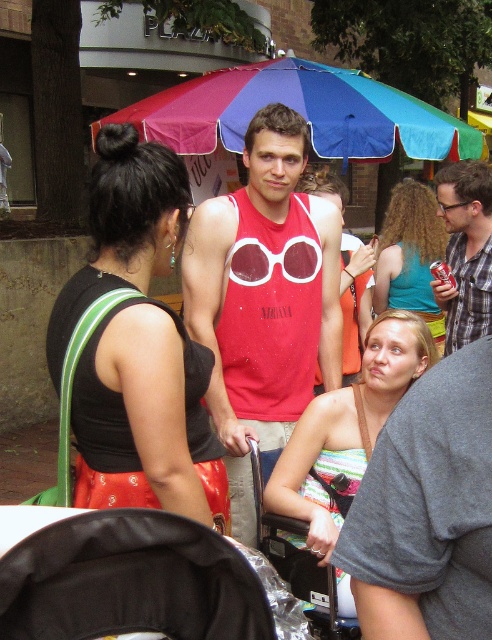
Question: Which object appears farthest from the camera in this image?

Choices:
 (A) matte plastic goggles at center
 (B) striped fabric dress at center
 (C) curly hair at center

Answer: (C)

Question: Can you confirm if curly hair at center is positioned above transparent plastic goggles at center?

Choices:
 (A) yes
 (B) no

Answer: (A)

Question: Based on their relative distances, which object is farther from the transparent plastic goggles at center?

Choices:
 (A) plaid shirt at center
 (B) matte plastic goggles at center
 (C) black fabric baby carriage at lower left
 (D) matte red tank top at center

Answer: (C)

Question: Can you confirm if black fabric baby carriage at lower left is wider than curly hair at center?

Choices:
 (A) yes
 (B) no

Answer: (B)

Question: Estimate the real-world distances between objects in this image. Which object is closer to the transparent plastic goggles at center?

Choices:
 (A) matte plastic goggles at center
 (B) matte red tank top at center
 (C) black fabric tank top at center

Answer: (B)

Question: Is black fabric tank top at center above black fabric baby carriage at lower left?

Choices:
 (A) yes
 (B) no

Answer: (A)